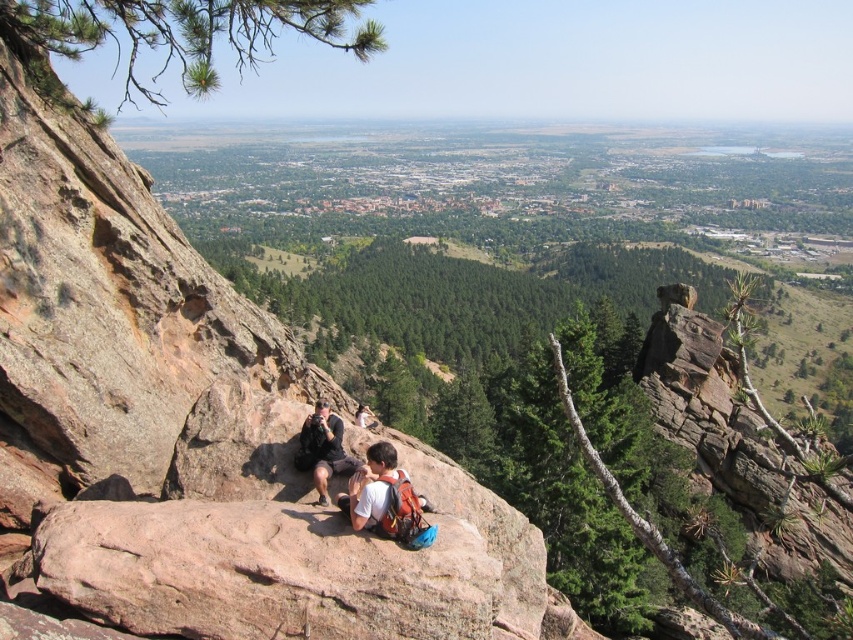
You are planning to set up a tripod for a time lapse of the sunset. You have a matte brown backpack at center and a rusty rock cliff at center. Which object can you use to stabilize the tripod if you need something taller than the backpack?

The rusty rock cliff at center is taller than the matte brown backpack at center, so you can use the rusty rock cliff at center to stabilize the tripod.

Looking at this image, you are a hiker who has just arrived at the overlook and want to place your matte brown backpack at center safely. Given that the rusty rock cliff at center has a rough surface, which object should you place your backpack next to for stability?

You should place your matte brown backpack at center next to the rusty rock cliff at center since it is positioned to the left of the backpack, providing a stable surface for support.

You are an adventurer who just arrived at the overlook and wants to place your matte brown backpack at center and black fabric camera at center on the ground. Since you want to ensure they don not block your view, which object should you place lower to the ground to avoid blocking your sightline?

The matte brown backpack at center has a lesser height compared to the black fabric camera at center, so you should place the black fabric camera at center lower to the ground to avoid blocking your view since it is taller and more likely to obstruct your sightline.